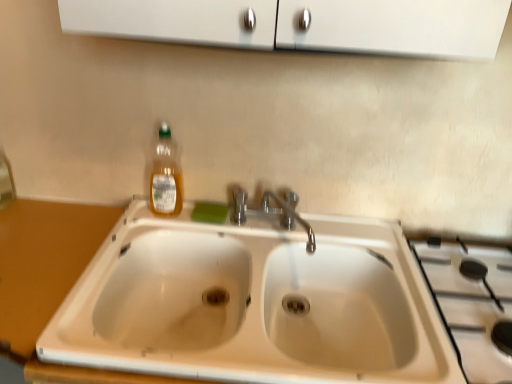
Where is `vacant space to the right of green sponge at sink`? vacant space to the right of green sponge at sink is located at coordinates (263, 226).